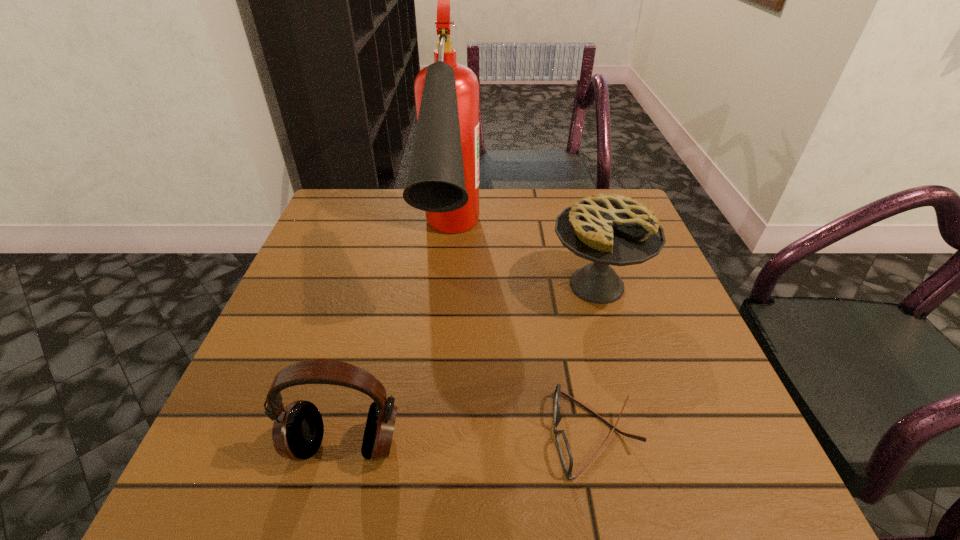
Where is `the third closest object to the fire extinguisher`? This screenshot has height=540, width=960. the third closest object to the fire extinguisher is located at coordinates (297, 433).

The width and height of the screenshot is (960, 540). What are the coordinates of `free region that satisfies the following two spatial constraints: 1. on the front-facing side of the shortest object; 2. on the ear pads of the headset` in the screenshot? It's located at tap(597, 444).

Where is `blank space that satisfies the following two spatial constraints: 1. on the front-facing side of the spectacles; 2. on the ear pads of the headset`? blank space that satisfies the following two spatial constraints: 1. on the front-facing side of the spectacles; 2. on the ear pads of the headset is located at coordinates (597, 444).

The image size is (960, 540). Identify the location of free space that satisfies the following two spatial constraints: 1. on the cut side of the pie; 2. on the front-facing side of the shortest object. (640, 434).